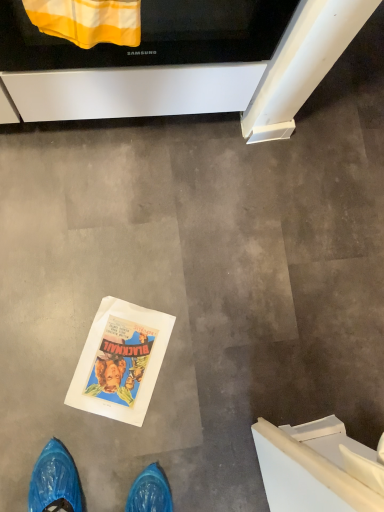
Question: In terms of size, does yellow striped fabric at upper center appear bigger or smaller than black glossy oven at upper center?

Choices:
 (A) big
 (B) small

Answer: (B)

Question: Is yellow striped fabric at upper center inside the boundaries of black glossy oven at upper center, or outside?

Choices:
 (A) inside
 (B) outside

Answer: (B)

Question: Relative to black glossy oven at upper center, is yellow striped fabric at upper center in front or behind?

Choices:
 (A) front
 (B) behind

Answer: (A)

Question: Considering the positions of point (41, 13) and point (33, 8), is point (41, 13) closer or farther from the camera than point (33, 8)?

Choices:
 (A) farther
 (B) closer

Answer: (B)

Question: In terms of width, does black glossy oven at upper center look wider or thinner when compared to yellow striped fabric at upper center?

Choices:
 (A) thin
 (B) wide

Answer: (B)

Question: Is black glossy oven at upper center bigger or smaller than yellow striped fabric at upper center?

Choices:
 (A) small
 (B) big

Answer: (B)

Question: In the image, is black glossy oven at upper center on the left side or the right side of yellow striped fabric at upper center?

Choices:
 (A) right
 (B) left

Answer: (A)